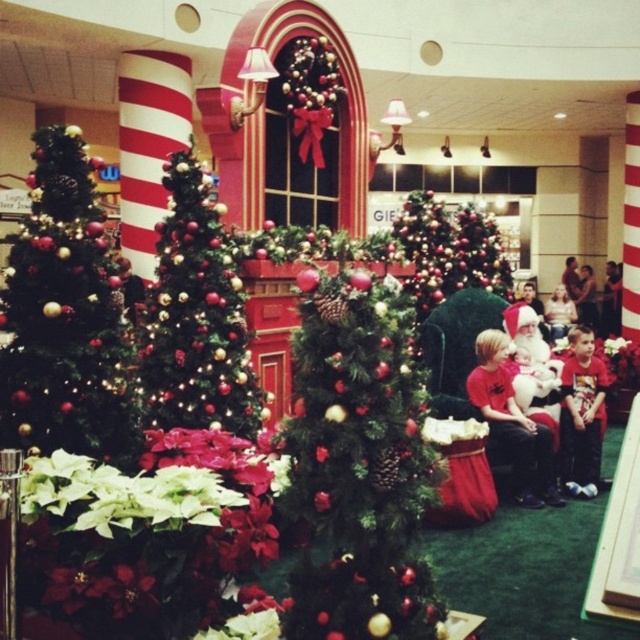
Is shiny green christmas tree at center taller than red matte shirt at lower right?

Correct, shiny green christmas tree at center is much taller as red matte shirt at lower right.

Does shiny green christmas tree at center have a lesser width compared to red matte shirt at lower right?

No, shiny green christmas tree at center is not thinner than red matte shirt at lower right.

Who is more forward, (432, 198) or (577, 356)?

Answer: Point (577, 356) is in front.

Identify the location of shiny green christmas tree at center. (449, 250).

Is shiny gold ornaments at left above red matte shirt at center?

Indeed, shiny gold ornaments at left is positioned over red matte shirt at center.

Is point (36, 184) less distant than point (515, 454)?

Yes, point (36, 184) is in front of point (515, 454).

Between point (92, 358) and point (522, 470), which one is positioned behind?

The point (522, 470) is more distant.

Identify the location of shiny gold ornaments at left. (67, 317).

Is shiny gold ornaments at left wider than shiny gold christmas tree at center?

No.

Consider the image. Which is above, shiny gold ornaments at left or shiny gold christmas tree at center?

shiny gold christmas tree at center

Which is behind, point (104, 253) or point (196, 380)?

The point (196, 380) is more distant.

Find the location of a particular element. The image size is (640, 640). shiny gold ornaments at left is located at coordinates (67, 317).